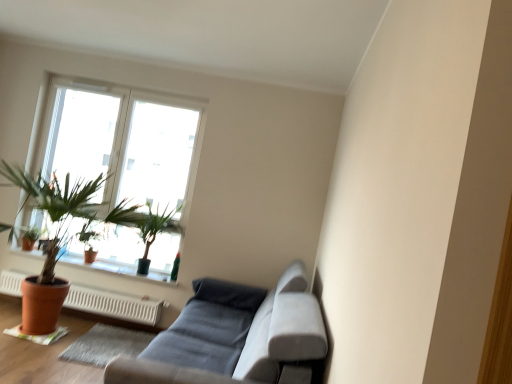
Identify the location of gray fabric couch at lower center. The image size is (512, 384). (252, 343).

Image resolution: width=512 pixels, height=384 pixels. Describe the element at coordinates (252, 343) in the screenshot. I see `gray fabric couch at lower center` at that location.

Describe the element at coordinates (29, 237) in the screenshot. I see `matte terracotta pot at left, positioned as the first houseplant in back-to-front order` at that location.

This screenshot has width=512, height=384. What do you see at coordinates (114, 304) in the screenshot?
I see `white plastic heater at lower left` at bounding box center [114, 304].

What is the approximate height of white plastic heater at lower left?

It is 10.86 inches.

The height and width of the screenshot is (384, 512). I want to click on terracotta pot plant at left, placed as the 3th houseplant when sorted from back to front, so click(x=65, y=212).

The image size is (512, 384). I want to click on transparent glass window at upper left, so click(x=124, y=142).

Are terracotta clay pot at lower left and transparent glass window at upper left making contact?

terracotta clay pot at lower left is not next to transparent glass window at upper left, and they're not touching.

Measure the distance between terracotta clay pot at lower left and transparent glass window at upper left.

A distance of 1.21 meters exists between terracotta clay pot at lower left and transparent glass window at upper left.

From a real-world perspective, which object stands above the other?

From a 3D spatial view, transparent glass window at upper left is above.

From the image's perspective, relative to transparent glass window at upper left, is terracotta clay pot at lower left above or below?

From the image's perspective, terracotta clay pot at lower left appears below transparent glass window at upper left.

Consider the image. How different are the orientations of terracotta clay pot at lower left and terracotta pot at lower left in degrees?

There is a 3.34-degree angle between the facing directions of terracotta clay pot at lower left and terracotta pot at lower left.

Can you confirm if terracotta clay pot at lower left is bigger than terracotta pot at lower left?

Incorrect, terracotta clay pot at lower left is not larger than terracotta pot at lower left.

The height and width of the screenshot is (384, 512). What are the coordinates of `flowerpot that appears behind the terracotta pot at lower left` in the screenshot? It's located at (89, 256).

Looking at their sizes, would you say terracotta clay pot at lower left is wider or thinner than terracotta pot at lower left?

Considering their sizes, terracotta clay pot at lower left looks slimmer than terracotta pot at lower left.

In the image, is transparent glass window at upper left positioned in front of or behind green matte plant at upper left, the second houseplant from the front?

transparent glass window at upper left is positioned farther from the viewer than green matte plant at upper left, the second houseplant from the front.

In the image, is transparent glass window at upper left on the left side or the right side of green matte plant at upper left, the second houseplant from the front?

transparent glass window at upper left is to the left of green matte plant at upper left, the second houseplant from the front.

Who is shorter, transparent glass window at upper left or green matte plant at upper left, the 2th houseplant when ordered from back to front?

green matte plant at upper left, the 2th houseplant when ordered from back to front.

Is transparent glass window at upper left completely or partially outside of green matte plant at upper left, the 2th houseplant when ordered from back to front?

That's correct, transparent glass window at upper left is outside of green matte plant at upper left, the 2th houseplant when ordered from back to front.

Is terracotta pot at lower left completely or partially inside terracotta pot plant at left, placed as the 3th houseplant when sorted from back to front?

Absolutely, terracotta pot at lower left is inside terracotta pot plant at left, placed as the 3th houseplant when sorted from back to front.

Can you confirm if terracotta pot plant at left, positioned as the 1th houseplant in front-to-back order, is thinner than terracotta pot at lower left?

No.

From the image's perspective, which is below, terracotta pot plant at left, placed as the 3th houseplant when sorted from back to front, or terracotta pot at lower left?

terracotta pot at lower left, from the image's perspective.

Is terracotta pot plant at left, positioned as the 1th houseplant in front-to-back order, to the left or to the right of terracotta pot at lower left in the image?

Clearly, terracotta pot plant at left, positioned as the 1th houseplant in front-to-back order, is on the left of terracotta pot at lower left in the image.

Which is nearer, (114,295) or (12,171)?

Point (114,295).

Based on the photo, who is taller, white plastic heater at lower left or terracotta pot plant at left, positioned as the 1th houseplant in front-to-back order?

terracotta pot plant at left, positioned as the 1th houseplant in front-to-back order.

Could you tell me if white plastic heater at lower left is turned towards terracotta pot plant at left, placed as the 3th houseplant when sorted from back to front?

Yes, white plastic heater at lower left is aimed at terracotta pot plant at left, placed as the 3th houseplant when sorted from back to front.

What are the coordinates of `window sill on the right of terracotta pot plant at left, positioned as the 1th houseplant in front-to-back order` in the screenshot? It's located at (118, 270).

Is terracotta pot at lower left not inside terracotta pot plant at left, placed as the 3th houseplant when sorted from back to front?

No, terracotta pot at lower left is not outside of terracotta pot plant at left, placed as the 3th houseplant when sorted from back to front.

In the scene shown: Considering the positions of objects terracotta pot at lower left and terracotta pot plant at left, positioned as the 1th houseplant in front-to-back order, in the image provided, who is more to the right, terracotta pot at lower left or terracotta pot plant at left, positioned as the 1th houseplant in front-to-back order,?

terracotta pot at lower left is more to the right.

Which object is further away from the camera taking this photo, terracotta pot at lower left or terracotta pot plant at left, placed as the 3th houseplant when sorted from back to front?

terracotta pot at lower left is further away from the camera.

Between gray fabric couch at lower center and green matte plant at upper left, the 2th houseplant when ordered from back to front, which one has larger size?

gray fabric couch at lower center is bigger.

What's the angular difference between gray fabric couch at lower center and green matte plant at upper left, the 2th houseplant when ordered from back to front,'s facing directions?

gray fabric couch at lower center and green matte plant at upper left, the 2th houseplant when ordered from back to front, are facing 91.9 degrees away from each other.

Would you say green matte plant at upper left, the second houseplant from the front, is part of gray fabric couch at lower center's contents?

No, green matte plant at upper left, the second houseplant from the front, is located outside of gray fabric couch at lower center.

Which of these two, gray fabric couch at lower center or green matte plant at upper left, the 2th houseplant when ordered from back to front, stands taller?

gray fabric couch at lower center is taller.

What are the coordinates of `window located in front of the terracotta clay pot at lower left` in the screenshot? It's located at (124, 142).

This screenshot has width=512, height=384. Find the location of `flowerpot on the left of terracotta pot at lower left`. flowerpot on the left of terracotta pot at lower left is located at coordinates (89, 256).

Consider the image. Which object lies nearer to the anchor point terracotta pot at lower left, terracotta pot plant at left, placed as the 3th houseplant when sorted from back to front, or matte terracotta pot at left, positioned as the first houseplant in back-to-front order?

terracotta pot plant at left, placed as the 3th houseplant when sorted from back to front, is closer to terracotta pot at lower left.

Based on their spatial positions, is gray fabric couch at lower center or transparent glass window at upper left closer to terracotta clay pot at lower left?

transparent glass window at upper left is positioned closer to the anchor terracotta clay pot at lower left.

Which object lies further to the anchor point terracotta pot plant at left, placed as the 3th houseplant when sorted from back to front, transparent glass window at upper left or gray fabric couch at lower center?

gray fabric couch at lower center.

Which object lies further to the anchor point gray fabric couch at lower center, transparent glass window at upper left or green matte plant at upper left, the second houseplant from the front?

transparent glass window at upper left is further to gray fabric couch at lower center.

Which object lies nearer to the anchor point gray fabric couch at lower center, white plastic heater at lower left or matte terracotta pot at left, placed as the third houseplant when sorted from front to back?

Among the two, white plastic heater at lower left is located nearer to gray fabric couch at lower center.

Which object lies further to the anchor point terracotta pot at lower left, white plastic heater at lower left or matte terracotta pot at left, positioned as the first houseplant in back-to-front order?

matte terracotta pot at left, positioned as the first houseplant in back-to-front order, is positioned further to the anchor terracotta pot at lower left.

Consider the image. Looking at the image, which one is located further to matte terracotta pot at left, positioned as the first houseplant in back-to-front order, terracotta pot plant at left, positioned as the 1th houseplant in front-to-back order, or white plastic heater at lower left?

white plastic heater at lower left is positioned further to the anchor matte terracotta pot at left, positioned as the first houseplant in back-to-front order.

Looking at the image, which one is located closer to white plastic heater at lower left, green matte plant at upper left, the second houseplant from the front, or matte terracotta pot at left, placed as the third houseplant when sorted from front to back?

green matte plant at upper left, the second houseplant from the front.

Locate an element on the screen. The image size is (512, 384). window sill between gray fabric couch at lower center and terracotta clay pot at lower left from front to back is located at coordinates (118, 270).

This screenshot has width=512, height=384. In order to click on heater situated between matte terracotta pot at left, placed as the third houseplant when sorted from front to back, and terracotta clay pot at lower left from left to right in this screenshot , I will do `click(114, 304)`.

Identify the location of window between terracotta pot plant at left, positioned as the 1th houseplant in front-to-back order, and terracotta clay pot at lower left from front to back. The width and height of the screenshot is (512, 384). click(x=124, y=142).

Where is `flowerpot between white plastic heater at lower left and green matte plant at upper left, the 2th houseplant when ordered from back to front, from left to right`? The image size is (512, 384). flowerpot between white plastic heater at lower left and green matte plant at upper left, the 2th houseplant when ordered from back to front, from left to right is located at coordinates (89, 256).